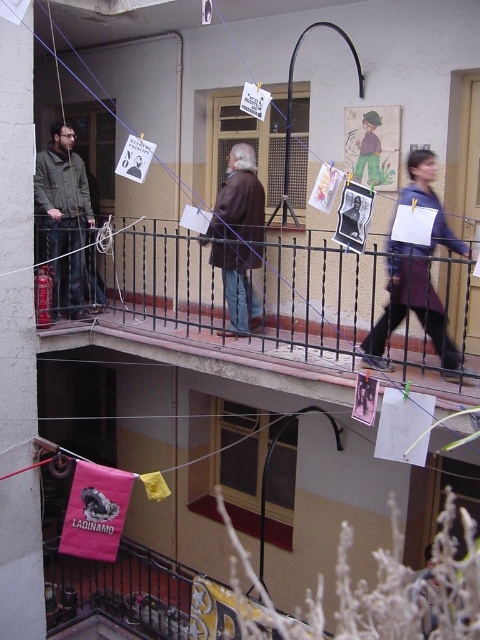
You are standing on the lower balcony and want to hand a book to the person wearing the matte black jacket at left and the brown leather jacket at center. Which person can you reach without climbing onto anything?

The brown leather jacket at center is located below the matte black jacket at left. Since you are on the lower balcony, the brown leather jacket at center is on the same level as you, so you can reach them. The matte black jacket at left is on the upper balcony, so you cannot reach them without climbing.

You are standing on the upper balcony looking down at the two objects at the center. Which object is closer to you, the brown leather jacket at center or the brown paper bag at center?

The brown leather jacket at center is closer to you because it is in front of the brown paper bag at center.

You are standing on the balcony and want to take a photo of a specific point marked at coordinates point (287, 284). The camera you have can only focus on objects within 6 meters. Will the camera be able to focus on that point?

The distance of point (287, 284) from camera is 6.21 meters, which is beyond the camera focus range of 6 meters. Therefore, the camera will not be able to focus on that point.